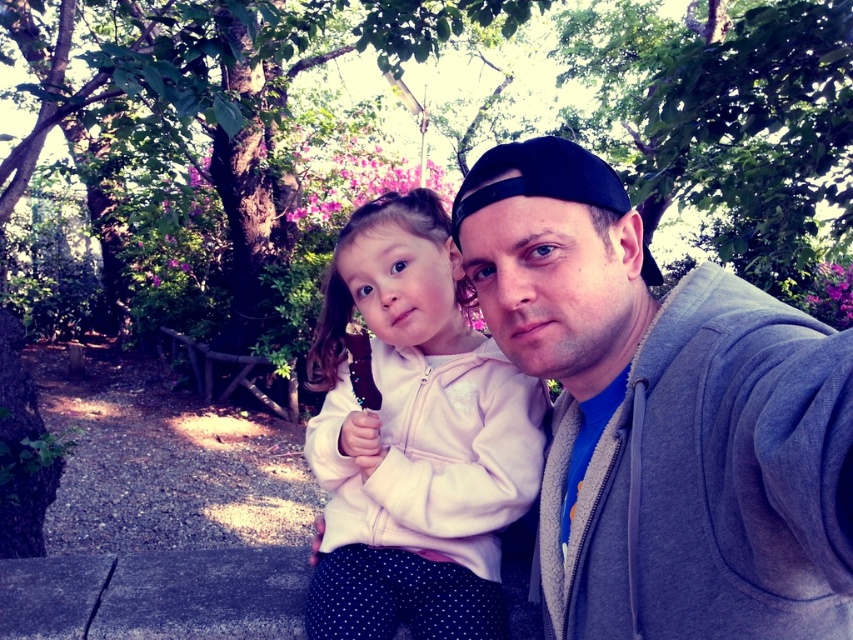
You are standing at the origin point in the park scene. The gray fleece jacket at center is located at coordinates 0.650 in the x and 0.777 in the y. If you want to walk directly to the jacket, in which direction should you move relative to the current position?

To reach the gray fleece jacket at center located at coordinates x 0.650 and y 0.777, you should move northeast since the jacket is positioned northeast of your starting point at the origin.

You are helping organize a clothing donation drive and need to sort jackets by size. You see a gray fleece jacket at center and a white fleece jacket at center. Which jacket should you place in the large size bin?

The gray fleece jacket at center should be placed in the large size bin because it has a larger size compared to the white fleece jacket at center.

You are a photographer setting up a shot in the park. You notice two jackets hanging on a tree branch in the center of the scene. The gray fleece jacket at center and the white fleece jacket at center. Which jacket is positioned higher on the branch?

The gray fleece jacket at center is above the white fleece jacket at center, so the gray fleece jacket at center is positioned higher on the branch.